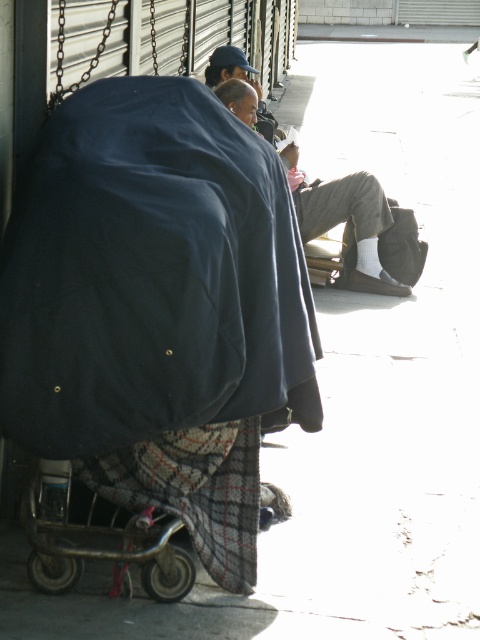
Question: Which point is farther to the camera?

Choices:
 (A) dark blue fabric at center
 (B) metallic silver cart at lower left
 (C) plaid fabric blanket at lower center

Answer: (C)

Question: Which of the following is the farthest from the observer?

Choices:
 (A) (325, 225)
 (B) (156, 508)
 (C) (94, 332)
 (D) (33, 500)

Answer: (A)

Question: Does dark blue fabric at center have a greater width compared to light brown leather jacket at center?

Choices:
 (A) yes
 (B) no

Answer: (A)

Question: Which object appears closest to the camera in this image?

Choices:
 (A) plaid fabric blanket at lower center
 (B) light brown leather jacket at center
 (C) metallic silver cart at lower left

Answer: (C)

Question: Is light brown leather jacket at center above metallic silver cart at lower left?

Choices:
 (A) yes
 (B) no

Answer: (A)

Question: Is dark blue fabric at center thinner than plaid fabric blanket at lower center?

Choices:
 (A) no
 (B) yes

Answer: (A)